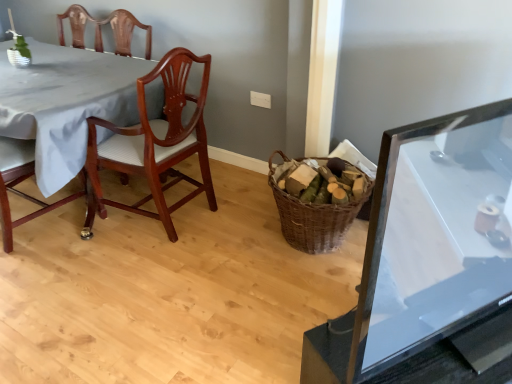
Question: Considering the relative sizes of mahogany wood chair at left, which is counted as the 1th chair, starting from the left, and woven brown basket at center in the image provided, is mahogany wood chair at left, which is counted as the 1th chair, starting from the left, smaller than woven brown basket at center?

Choices:
 (A) no
 (B) yes

Answer: (A)

Question: Considering the relative sizes of mahogany wood chair at left, the second chair in the right-to-left sequence, and woven brown basket at center in the image provided, is mahogany wood chair at left, the second chair in the right-to-left sequence, shorter than woven brown basket at center?

Choices:
 (A) no
 (B) yes

Answer: (A)

Question: Is mahogany wood chair at left, the second chair in the right-to-left sequence, to the left of woven brown basket at center from the viewer's perspective?

Choices:
 (A) yes
 (B) no

Answer: (A)

Question: Would you say mahogany wood chair at left, the second chair in the right-to-left sequence, contains woven brown basket at center?

Choices:
 (A) yes
 (B) no

Answer: (B)

Question: Is mahogany wood chair at left, which is counted as the 1th chair, starting from the left, further to the viewer compared to woven brown basket at center?

Choices:
 (A) no
 (B) yes

Answer: (A)

Question: From a real-world perspective, is transparent glass table at right, which ranks as the 2th table in left-to-right order, above or below mahogany wood chair at left, which is the 2th chair in left-to-right order?

Choices:
 (A) above
 (B) below

Answer: (A)

Question: Looking at the image, does transparent glass table at right, the first table in the front-to-back sequence, seem bigger or smaller compared to mahogany wood chair at left, which is the 2th chair in left-to-right order?

Choices:
 (A) big
 (B) small

Answer: (B)

Question: Based on their positions, is transparent glass table at right, which ranks as the 2th table in left-to-right order, located to the left or right of mahogany wood chair at left, which ranks as the 1th chair in right-to-left order?

Choices:
 (A) left
 (B) right

Answer: (B)

Question: Do you think transparent glass table at right, placed as the first table when sorted from right to left, is within mahogany wood chair at left, which ranks as the 1th chair in right-to-left order, or outside of it?

Choices:
 (A) inside
 (B) outside

Answer: (B)

Question: In the image, is transparent glass table at right, the first table in the front-to-back sequence, on the left side or the right side of white fabric table at left, which ranks as the second table in right-to-left order?

Choices:
 (A) left
 (B) right

Answer: (B)

Question: Is transparent glass table at right, the first table in the front-to-back sequence, inside the boundaries of white fabric table at left, which ranks as the second table in right-to-left order, or outside?

Choices:
 (A) outside
 (B) inside

Answer: (A)

Question: Based on their sizes in the image, would you say transparent glass table at right, placed as the first table when sorted from right to left, is bigger or smaller than white fabric table at left, the 2th table from the front?

Choices:
 (A) small
 (B) big

Answer: (A)

Question: Considering the positions of point tap(366, 344) and point tap(35, 48), is point tap(366, 344) closer or farther from the camera than point tap(35, 48)?

Choices:
 (A) closer
 (B) farther

Answer: (A)

Question: Is mahogany wood chair at left, which is counted as the 1th chair, starting from the left, spatially inside transparent glass table at right, the first table in the front-to-back sequence, or outside of it?

Choices:
 (A) outside
 (B) inside

Answer: (A)

Question: From the image's perspective, is mahogany wood chair at left, which is counted as the 1th chair, starting from the left, positioned above or below transparent glass table at right, which ranks as the 2th table in left-to-right order?

Choices:
 (A) below
 (B) above

Answer: (B)